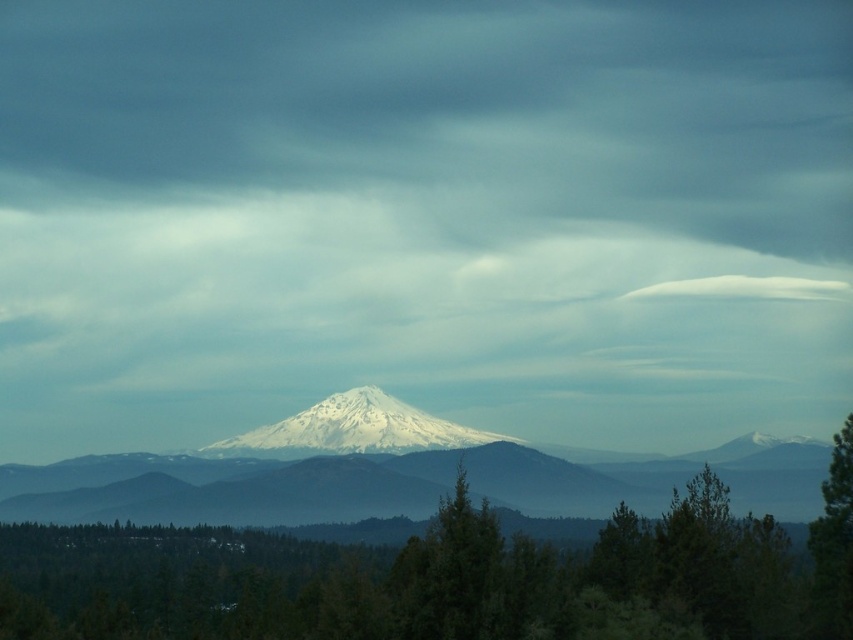
You are a hiker planning to take a photo of the snowy peak at center from the green matte tree at center. Considering their sizes, which object would appear larger in your camera frame?

The green matte tree at center might appear larger in your camera frame since it is possibly wider than the snowy peak at center.

You are a hiker planning to take a photo of the snowy peak at center and the green matte tree at right from a viewpoint. Which object will appear higher in your photo?

The snowy peak at center will appear higher in your photo since it is located above the green matte tree at right.